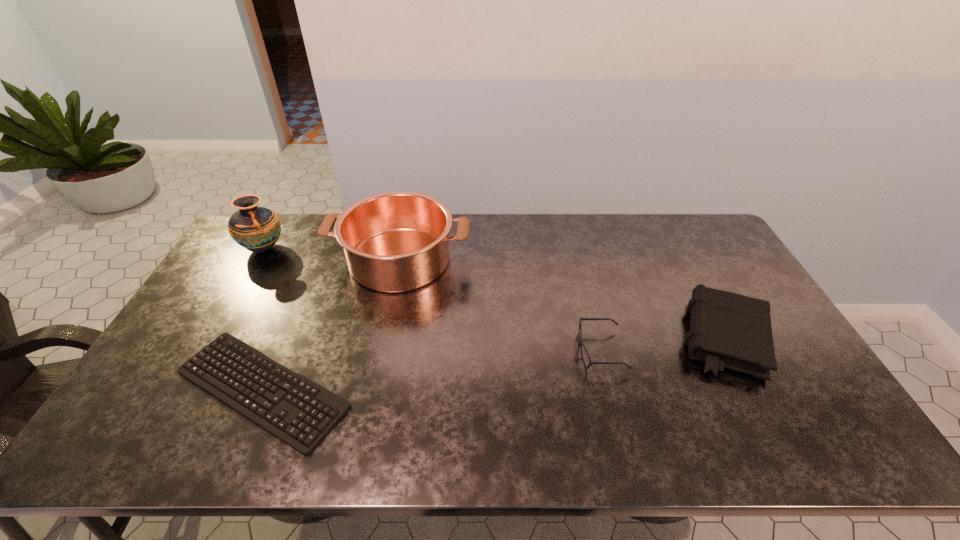
The height and width of the screenshot is (540, 960). I want to click on empty location between the pottery and the second tallest object, so click(x=332, y=254).

The height and width of the screenshot is (540, 960). I want to click on empty space between the saucepan and the pottery, so click(332, 254).

In order to click on unoccupied position between the rightmost object and the pottery in this screenshot , I will do `click(494, 293)`.

This screenshot has height=540, width=960. In order to click on free space between the saucepan and the computer keyboard in this screenshot , I will do `click(331, 324)`.

Find the location of `free space between the fourth tallest object and the saucepan`. free space between the fourth tallest object and the saucepan is located at coordinates (500, 305).

Identify the location of free space between the rightmost object and the second shortest object. (662, 344).

This screenshot has height=540, width=960. Find the location of `vacant area that lies between the computer keyboard and the fourth shortest object`. vacant area that lies between the computer keyboard and the fourth shortest object is located at coordinates point(331,324).

You are a GUI agent. You are given a task and a screenshot of the screen. Output one action in this format:
    pyautogui.click(x=<x>, y=<y>)
    Task: Click on the closest object to the pottery
    The width and height of the screenshot is (960, 540).
    Given the screenshot: What is the action you would take?
    pyautogui.click(x=398, y=241)

Select which object is the second closest to the shortest object. Please provide its 2D coordinates. Your answer should be formatted as a tuple, i.e. [(x, y)], where the tuple contains the x and y coordinates of a point satisfying the conditions above.

[(257, 229)]

At what (x,y) coordinates should I click in order to perform the action: click on vacant space that satisfies the following two spatial constraints: 1. on the front-facing side of the fourth object from left to right; 2. on the front side of the computer keyboard. Please return your answer as a coordinate pair (x, y). Image resolution: width=960 pixels, height=540 pixels. Looking at the image, I should click on (610, 388).